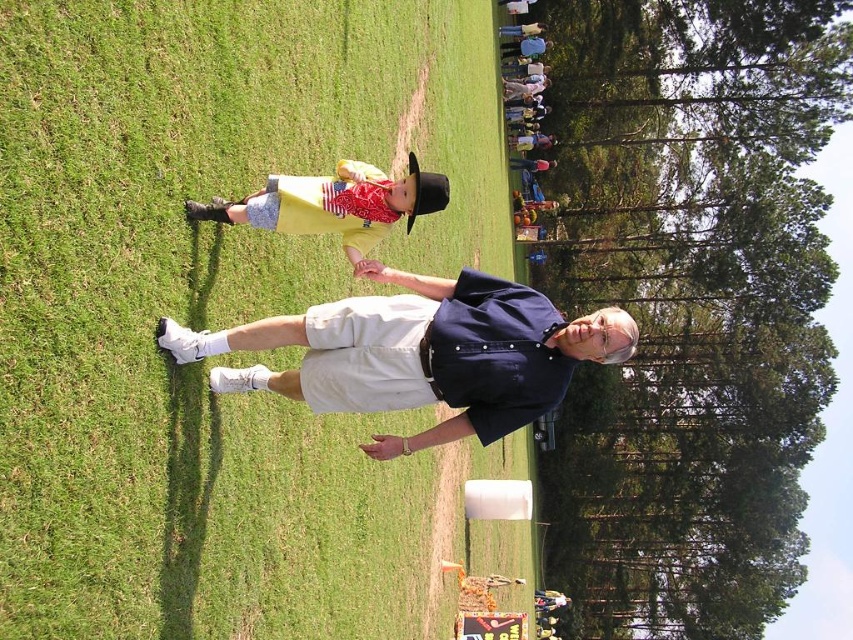
Can you confirm if dark blue shirt at center is positioned to the right of matte yellow shirt at center?

Yes, dark blue shirt at center is to the right of matte yellow shirt at center.

You are a GUI agent. You are given a task and a screenshot of the screen. Output one action in this format:
    pyautogui.click(x=<x>, y=<y>)
    Task: Click on the dark blue shirt at center
    Image resolution: width=853 pixels, height=640 pixels.
    Given the screenshot: What is the action you would take?
    pyautogui.click(x=422, y=353)

Is green grass at center bigger than matte yellow shirt at center?

Correct, green grass at center is larger in size than matte yellow shirt at center.

Is green grass at center to the right of matte yellow shirt at center from the viewer's perspective?

Yes, green grass at center is to the right of matte yellow shirt at center.

Is point (376, 600) closer to viewer compared to point (236, 202)?

That is False.

Identify the location of green grass at center. (223, 316).

Consider the image. Which is above, green grass at center or dark blue shirt at center?

dark blue shirt at center is higher up.

What do you see at coordinates (223, 316) in the screenshot? I see `green grass at center` at bounding box center [223, 316].

Image resolution: width=853 pixels, height=640 pixels. In order to click on green grass at center in this screenshot , I will do tap(223, 316).